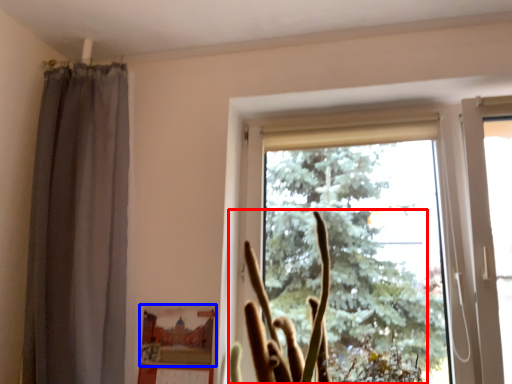
Question: Which object appears farthest to the camera in this image, plant (highlighted by a red box) or picture frame (highlighted by a blue box)?

Choices:
 (A) plant
 (B) picture frame

Answer: (B)